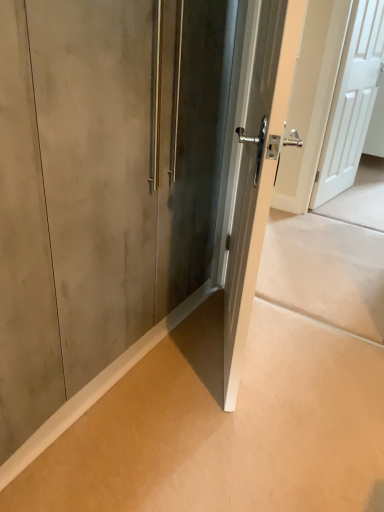
I want to click on vacant area that lies to the right of satin silver door at center, the 2th door positioned from the back, so click(302, 355).